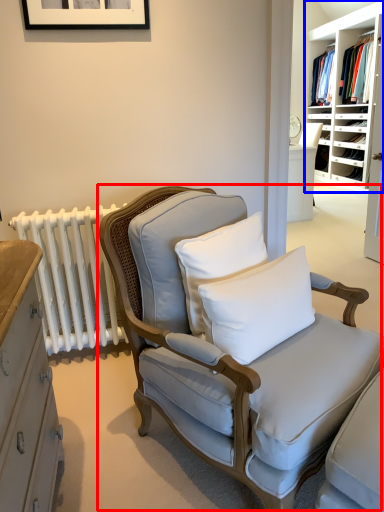
Question: Among these objects, which one is farthest to the camera, chair (highlighted by a red box) or shelf (highlighted by a blue box)?

Choices:
 (A) chair
 (B) shelf

Answer: (B)